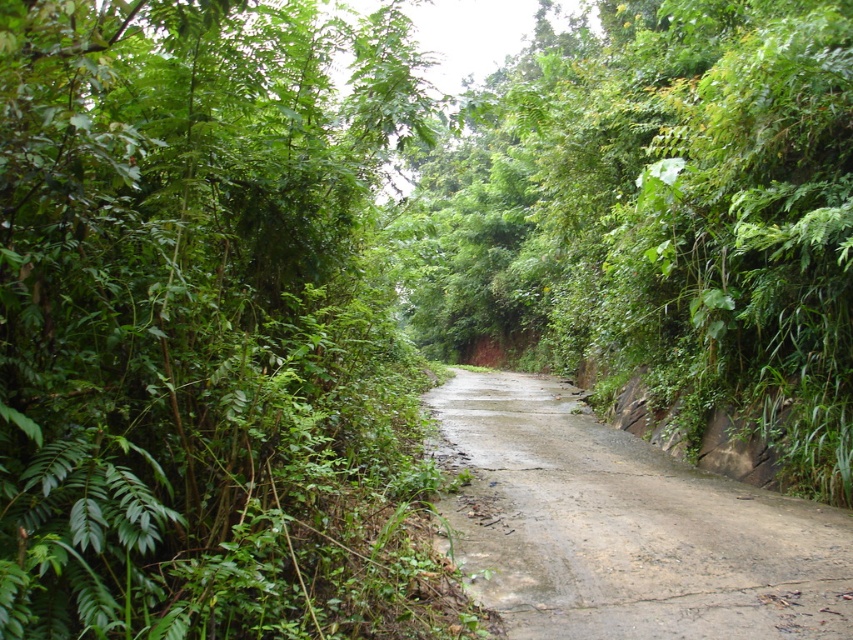
In the scene shown: You are driving a car that is 2 meters wide. You see the green leafy tree at center and the dull gray concrete at center in the middle of the road. Can your car pass through the space between them?

The green leafy tree at center is larger in size than the dull gray concrete at center. Since the tree is bigger, it might block the path. The car is 2 meters wide, but the description doesn not specify the distance between them. Without knowing the gap, it s hard to say if the car can pass safely. You should slow down and assess the space carefully before proceeding.

You are driving a tall truck that is 4 meters in height. You come across a narrow dirt road bordered by green leafy trees. The road has a green leafy tree at left and a green leafy tree at center. Can your truck pass through without hitting any trees?

The green leafy tree at left has a lesser height compared to green leafy tree at center. Since the truck is 4 meters tall, you need to check the height of both trees. However, the description only provides a comparison between the two trees, not their exact heights. Therefore, it is uncertain if the truck can pass safely without hitting the taller green leafy tree at center.

You are driving a car that is 6 feet wide. You see a narrow dirt road bordered by green leafy tree at left. Can your car safely pass through the road without hitting the tree?

The distance between the green leafy tree at left and the camera is 5.82 feet. Since the car is 6 feet wide, it is wider than the available space, so the car cannot safely pass through without hitting the tree.